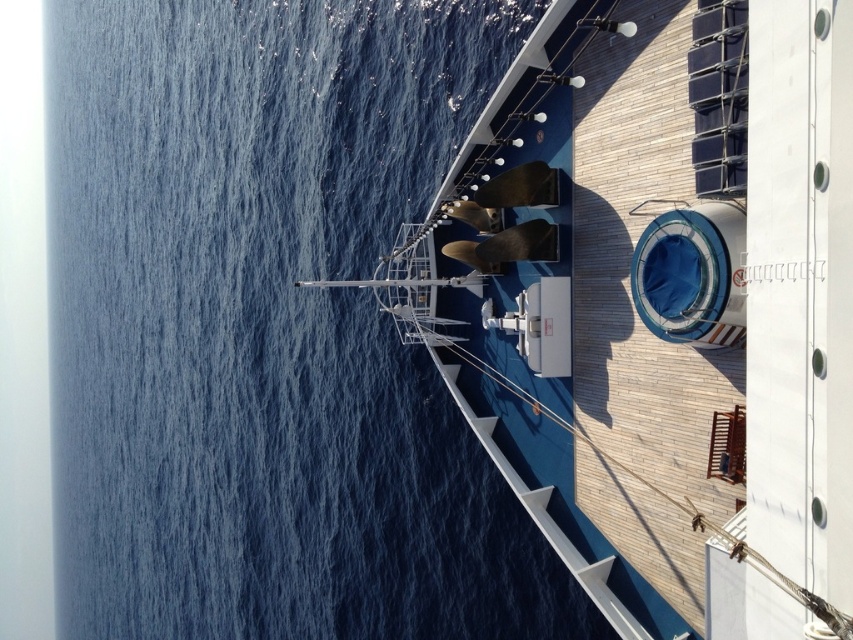
You are standing on the ship deck and looking towards the blue water at upper left and the white glossy boat at upper center. Which object appears taller from your perspective?

The blue water at upper left appears taller than the white glossy boat at upper center because it is much taller as described.

You are standing on the ship deck and want to take a photo of the blue water at upper left and white glossy boat at upper center in the same frame. Which object should you position closer to the left side of your camera viewfinder to include both?

To include both the blue water at upper left and the white glossy boat at upper center in the same frame, position the blue water at upper left closer to the left side of your camera viewfinder since it is located to the left of the white glossy boat at upper center.

You are a passenger on the ship and want to take a photo of the blue water at upper left and the white glossy boat at upper center. Which object will occupy more space in your photo?

The blue water at upper left will occupy more space in the photo because it is larger in size than the white glossy boat at upper center according to the description.